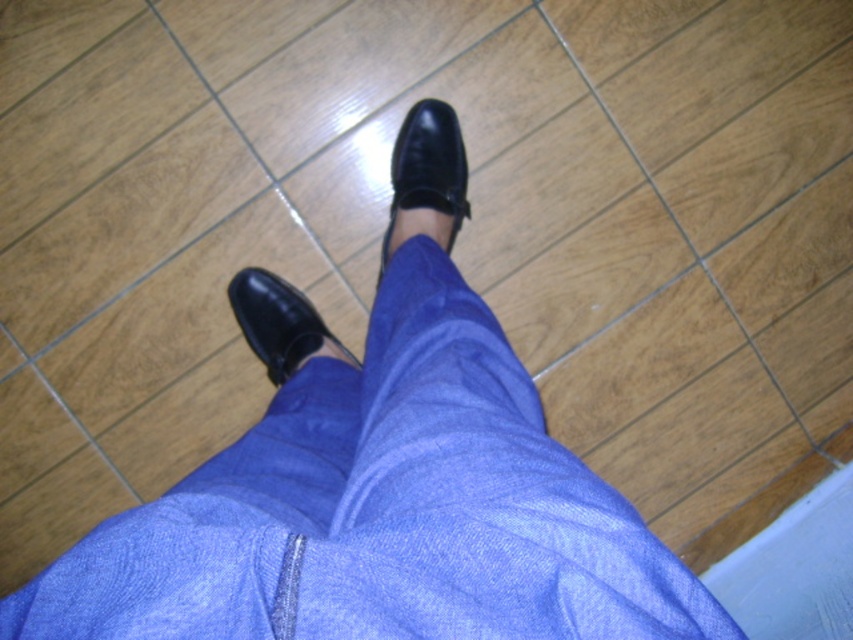
Who is positioned more to the left, denim pants at center or black leather shoe at lower center?

black leather shoe at lower center is more to the left.

Can you confirm if denim pants at center is positioned above black leather shoe at lower center?

Actually, denim pants at center is below black leather shoe at lower center.

Which is behind, point (331, 449) or point (329, 333)?

Point (329, 333)

Where is `denim pants at center`? This screenshot has width=853, height=640. denim pants at center is located at coordinates (381, 509).

Which is behind, point (364, 396) or point (425, 106)?

The point (425, 106) is behind.

Is point (460, 536) positioned behind point (445, 204)?

No.

The width and height of the screenshot is (853, 640). Identify the location of denim pants at center. (381, 509).

Can you confirm if shiny black shoe at center is thinner than black leather shoe at lower center?

Yes.

In order to click on shiny black shoe at center in this screenshot , I will do `click(428, 166)`.

This screenshot has height=640, width=853. What do you see at coordinates (428, 166) in the screenshot?
I see `shiny black shoe at center` at bounding box center [428, 166].

Image resolution: width=853 pixels, height=640 pixels. In order to click on shiny black shoe at center in this screenshot , I will do `click(428, 166)`.